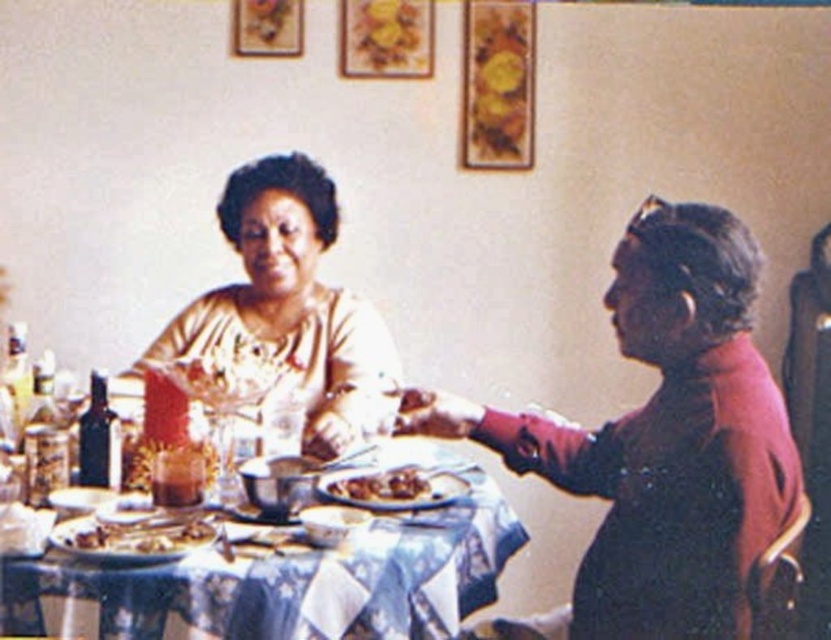
Is matte gold dress at center above gold textured blouse at upper left?

No.

In the scene shown: Who is more forward, (515, 637) or (178, 321)?

Point (515, 637) is more forward.

Who is more distant from viewer, (687, 205) or (293, 280)?

Point (293, 280)

Where is `matte gold dress at center`? matte gold dress at center is located at coordinates (546, 416).

Can you confirm if matte gold dress at center is positioned below blue printed fabric tablecloth at center?

Incorrect, matte gold dress at center is not positioned below blue printed fabric tablecloth at center.

Who is more distant from viewer, (735, 340) or (126, 625)?

Point (735, 340)

Where is `matte gold dress at center`? matte gold dress at center is located at coordinates (546, 416).

Is matte gold dress at center smaller than shiny brown meat at center?

Incorrect, matte gold dress at center is not smaller in size than shiny brown meat at center.

Who is more forward, (288, 579) or (416, 476)?

Positioned in front is point (288, 579).

The width and height of the screenshot is (831, 640). I want to click on matte gold dress at center, so click(546, 416).